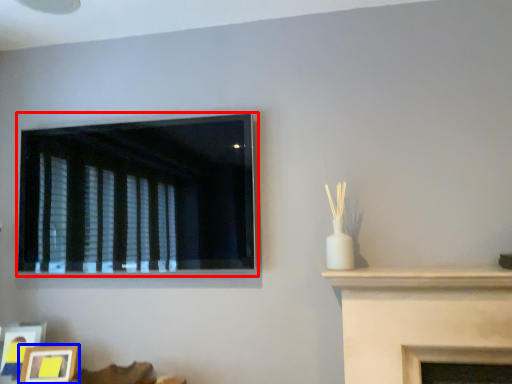
Question: Which object is further to the camera taking this photo, window (highlighted by a red box) or picture frame (highlighted by a blue box)?

Choices:
 (A) window
 (B) picture frame

Answer: (B)